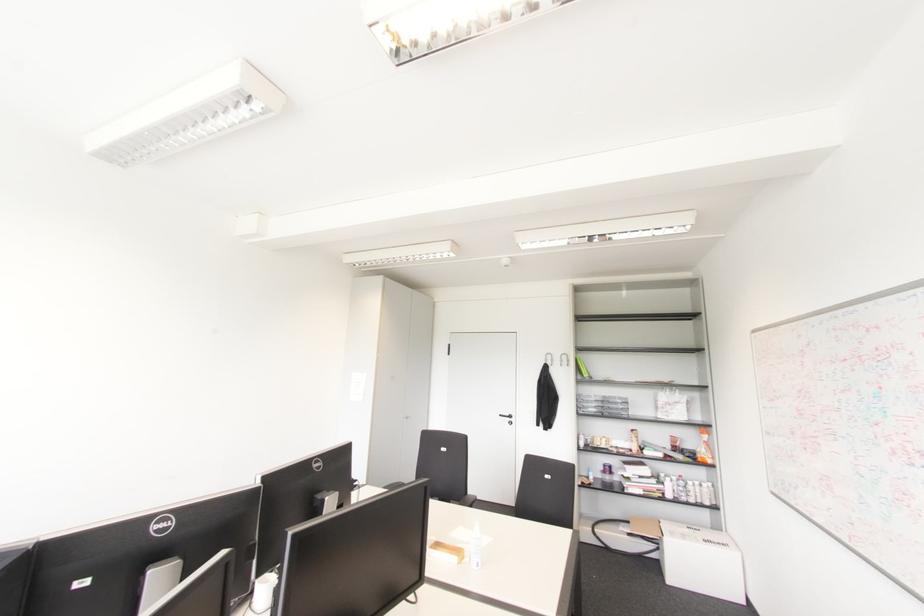
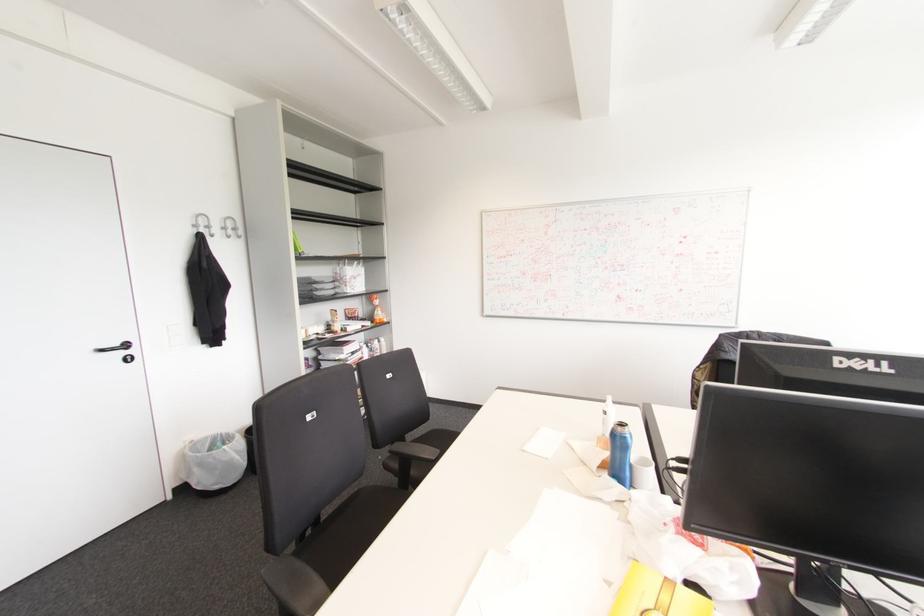
Locate, in the second image, the point that corresponds to [509,416] in the first image.

(126, 345)